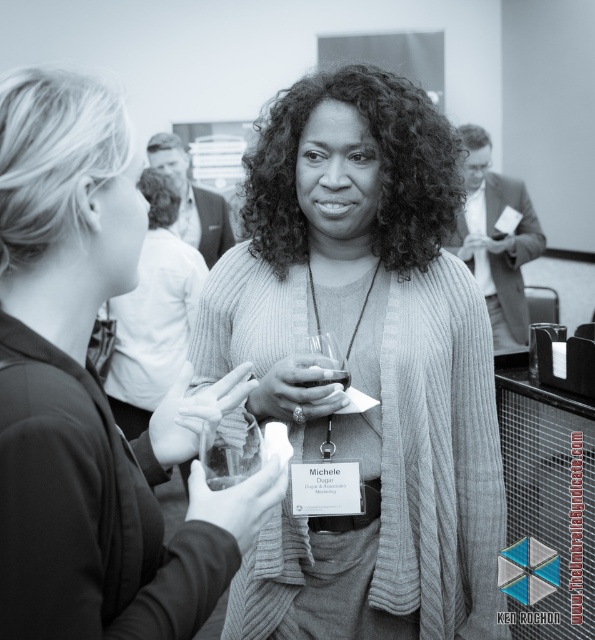
You are organizing a photo shoot and need to place a small decorative item between the woolen cardigan at center and the translucent glass wine at center. Based on their sizes, which object should the item be placed closer to?

The item should be placed closer to the woolen cardigan at center because it might be wider than the translucent glass wine at center.

You are at a networking event and notice the clear glass wine glass at center and the translucent glass wine at center. Which object is wider?

The clear glass wine glass at center might be wider than the translucent glass wine at center.

From the picture: You are standing at the camera position and want to take a photo of the point at coordinates point (334,369). Is the point within your camera frame?

The point (334,369) is 1.36 meters away from the camera, so it is within the camera frame.